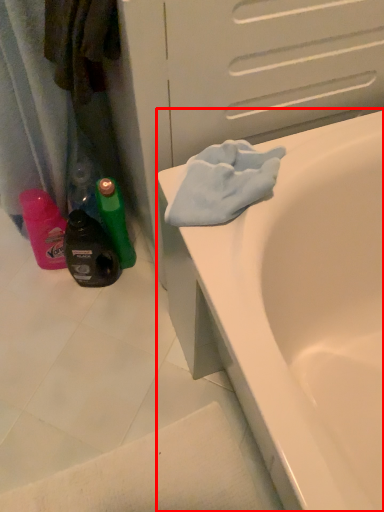
Question: In this image, where is bathtub (annotated by the red box) located relative to bottle?

Choices:
 (A) right
 (B) left

Answer: (A)